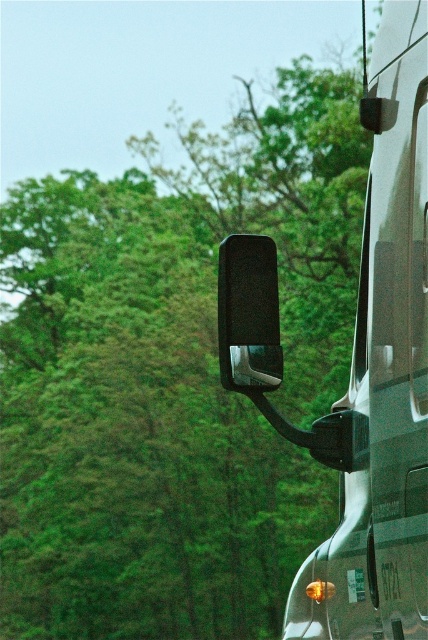
You are standing in front of the vehicle shown in the image. Based on the coordinates provided, can you identify which object corresponds to the point at (x=359, y=365)?

The point at (x=359, y=365) corresponds to the metallic silver recreational vehicle at right.

You are a mechanic working on a vehicle. You need to install a new black matte car mirror at upper right on the metallic silver recreational vehicle at right. The manufacturer specifies that there must be at least 4 inches of clearance between the mirror and the vehicle body to avoid interference. Based on the image, will the current spacing meet the requirement?

The distance between the metallic silver recreational vehicle at right and the black matte car mirror at upper right is 4.06 inches, which exceeds the required 4 inches of clearance. Therefore, the current spacing meets the manufacturer specification.

You are a driver trying to park your car in a tight space. You notice the metallic silver recreational vehicle at right and the black matte car mirror at upper right. Which object is closer to the right edge of your view?

The metallic silver recreational vehicle at right is positioned on the right side of black matte car mirror at upper right, meaning it is closer to the right edge of the view.